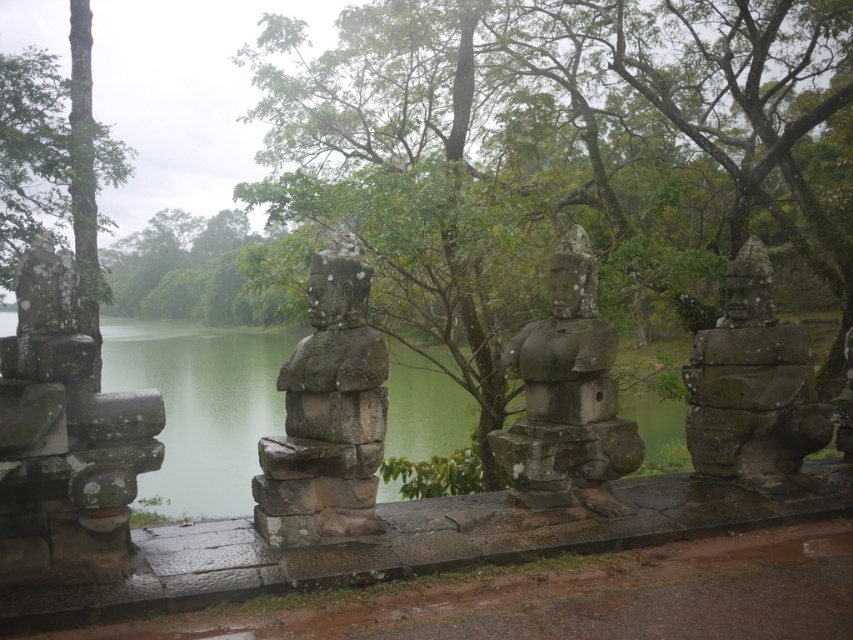
You are a photographer planning to capture a landscape photo that includes both the gray stone statue at right and the green rough bark tree at upper left. Based on their sizes, which object should you position closer to the center of the frame to ensure both are clearly visible?

The gray stone statue at right is smaller in size compared to the green rough bark tree at upper left. To ensure both are clearly visible in the photo, you should position the gray stone statue at right closer to the center of the frame since it is smaller and might otherwise get lost in the composition if placed too far from the center.

You are standing at the viewpoint where the image was taken. There are two points marked in the scene, point 1 at coordinates point (51,266) and point 2 at coordinates point (540,483). Which point is closer to you?

Point (51,266) is closer to the camera than point (540,483), so the point closer to you is point (51,266).